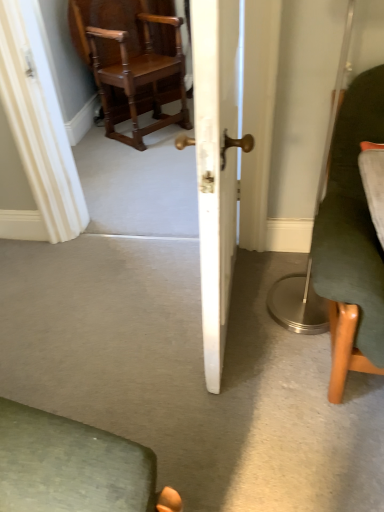
Locate an element on the screen. Image resolution: width=384 pixels, height=512 pixels. polished wood chair at upper left, which ranks as the 1th chair in top-to-bottom order is located at coordinates (132, 60).

What is the approximate width of dark green fabric chair at right, the 2th chair in the top-to-bottom sequence?

dark green fabric chair at right, the 2th chair in the top-to-bottom sequence, is 14.30 inches wide.

This screenshot has height=512, width=384. I want to click on polished wood chair at upper left, the second chair when ordered from front to back, so [132, 60].

Is white wood door at center positioned before dark green fabric chair at right, which is the second chair from back to front?

That is True.

Would you say white wood door at center is a long distance from dark green fabric chair at right, the 2th chair in the top-to-bottom sequence?

That's not correct — white wood door at center is a little close to dark green fabric chair at right, the 2th chair in the top-to-bottom sequence.

From the image's perspective, is white wood door at center located beneath dark green fabric chair at right, the 2th chair in the left-to-right sequence?

No, from the image's perspective, white wood door at center is not below dark green fabric chair at right, the 2th chair in the left-to-right sequence.

Is polished wood chair at upper left, the first chair when ordered from back to front, next to white wood door at center?

They are not placed beside each other.

In the scene shown: Can you tell me how much polished wood chair at upper left, positioned as the 1th chair in left-to-right order, and white wood door at center differ in facing direction?

They differ by 143 degrees in their facing directions.

From the image's perspective, is polished wood chair at upper left, the first chair when ordered from back to front, below white wood door at center?

No.

Considering the positions of points (116, 138) and (216, 236), is point (116, 138) farther from camera compared to point (216, 236)?

Yes, it is.

Which object is closer to the camera, polished wood chair at upper left, the first chair when ordered from back to front, or dark green fabric chair at right, the 1th chair viewed from the front?

dark green fabric chair at right, the 1th chair viewed from the front.

From the image's perspective, is polished wood chair at upper left, the 2th chair when ordered from right to left, above or below dark green fabric chair at right, the 2th chair in the left-to-right sequence?

Clearly, from the image's perspective, polished wood chair at upper left, the 2th chair when ordered from right to left, is above dark green fabric chair at right, the 2th chair in the left-to-right sequence.

Considering the points (117, 69) and (319, 269), which point is in front, point (117, 69) or point (319, 269)?

Point (319, 269)

Which of these two, polished wood chair at upper left, positioned as the 1th chair in left-to-right order, or dark green fabric chair at right, the 2th chair in the top-to-bottom sequence, stands shorter?

dark green fabric chair at right, the 2th chair in the top-to-bottom sequence.

Looking at this image, which object is closer to the camera, dark green fabric chair at right, which is the first chair in right-to-left order, or white wood door at center?

white wood door at center.

Is dark green fabric chair at right, arranged as the 1th chair when ordered from the bottom, not close to white wood door at center?

dark green fabric chair at right, arranged as the 1th chair when ordered from the bottom, is near white wood door at center, not far away.

Is dark green fabric chair at right, the 2th chair in the left-to-right sequence, inside or outside of white wood door at center?

The correct answer is: outside.

Does dark green fabric chair at right, which is the first chair in right-to-left order, turn towards polished wood chair at upper left, the 2th chair when ordered from right to left?

No.

From a real-world perspective, is dark green fabric chair at right, which is the first chair in right-to-left order, positioned over polished wood chair at upper left, which ranks as the 1th chair in top-to-bottom order, based on gravity?

Yes, from a real-world perspective, dark green fabric chair at right, which is the first chair in right-to-left order, is on top of polished wood chair at upper left, which ranks as the 1th chair in top-to-bottom order.

How different are the orientations of dark green fabric chair at right, the 2th chair in the left-to-right sequence, and polished wood chair at upper left, the second chair when ordered from front to back, in degrees?

The angular difference between dark green fabric chair at right, the 2th chair in the left-to-right sequence, and polished wood chair at upper left, the second chair when ordered from front to back, is 45 degrees.

Considering the positions of points (366, 211) and (184, 93), is point (366, 211) closer to camera compared to point (184, 93)?

Yes, point (366, 211) is closer to viewer.

Is white wood door at center positioned far away from polished wood chair at upper left, the second chair when ordered from front to back?

white wood door at center is positioned a significant distance from polished wood chair at upper left, the second chair when ordered from front to back.

From a real-world perspective, is white wood door at center on top of polished wood chair at upper left, the 2th chair when ordered from right to left?

Yes, from a real-world perspective, white wood door at center is over polished wood chair at upper left, the 2th chair when ordered from right to left

Is point (216, 38) less distant than point (77, 48)?

Yes, it is.

Is polished wood chair at upper left, arranged as the 2th chair when ordered from the bottom, inside white wood door at center?

That's incorrect, polished wood chair at upper left, arranged as the 2th chair when ordered from the bottom, is not inside white wood door at center.

Where is `door on the left side of dark green fabric chair at right, the 2th chair in the top-to-bottom sequence`? door on the left side of dark green fabric chair at right, the 2th chair in the top-to-bottom sequence is located at coordinates (215, 166).

The width and height of the screenshot is (384, 512). I want to click on door in front of the polished wood chair at upper left, which ranks as the 1th chair in top-to-bottom order, so click(x=215, y=166).

Estimate the real-world distances between objects in this image. Which object is further from dark green fabric chair at right, arranged as the 1th chair when ordered from the bottom, white wood door at center or polished wood chair at upper left, which ranks as the 1th chair in top-to-bottom order?

The object further to dark green fabric chair at right, arranged as the 1th chair when ordered from the bottom, is polished wood chair at upper left, which ranks as the 1th chair in top-to-bottom order.

From the image, which object appears to be nearer to polished wood chair at upper left, the second chair when ordered from front to back, white wood door at center or dark green fabric chair at right, the 2th chair in the top-to-bottom sequence?

Among the two, white wood door at center is located nearer to polished wood chair at upper left, the second chair when ordered from front to back.

In the scene shown: Looking at the image, which one is located further to polished wood chair at upper left, positioned as the 1th chair in left-to-right order, dark green fabric chair at right, the 1th chair viewed from the front, or white wood door at center?

Among the two, dark green fabric chair at right, the 1th chair viewed from the front, is located further to polished wood chair at upper left, positioned as the 1th chair in left-to-right order.

Looking at the image, which one is located closer to white wood door at center, dark green fabric chair at right, the 2th chair in the top-to-bottom sequence, or polished wood chair at upper left, which ranks as the 1th chair in top-to-bottom order?

dark green fabric chair at right, the 2th chair in the top-to-bottom sequence.

When comparing their distances from dark green fabric chair at right, arranged as the 1th chair when ordered from the bottom, does polished wood chair at upper left, the first chair when ordered from back to front, or white wood door at center seem closer?

white wood door at center is closer to dark green fabric chair at right, arranged as the 1th chair when ordered from the bottom.

When comparing their distances from white wood door at center, does polished wood chair at upper left, the 2th chair when ordered from right to left, or dark green fabric chair at right, the 2th chair in the top-to-bottom sequence, seem further?

polished wood chair at upper left, the 2th chair when ordered from right to left.

At what (x,y) coordinates should I click in order to perform the action: click on chair between white wood door at center and polished wood chair at upper left, the first chair when ordered from back to front, along the z-axis. Please return your answer as a coordinate pair (x, y). Image resolution: width=384 pixels, height=512 pixels. Looking at the image, I should click on tap(351, 239).